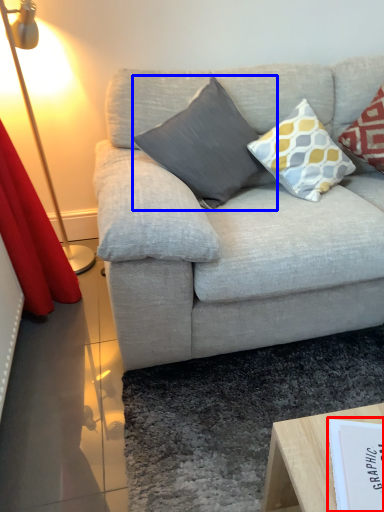
Question: Which of the following is the closest to the observer, paperback book (highlighted by a red box) or pillow (highlighted by a blue box)?

Choices:
 (A) paperback book
 (B) pillow

Answer: (A)